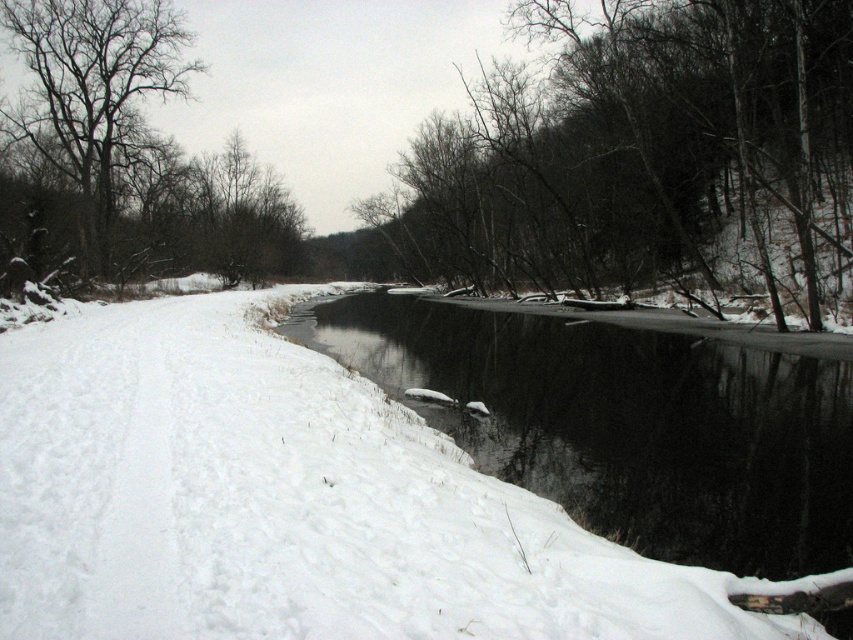
Does black ice at center appear on the right side of bare branches at left?

Yes, black ice at center is to the right of bare branches at left.

Who is positioned more to the left, black ice at center or bare branches at left?

Positioned to the left is bare branches at left.

Which is behind, point (494, 396) or point (47, 152)?

Positioned behind is point (47, 152).

The width and height of the screenshot is (853, 640). In order to click on black ice at center in this screenshot , I will do `click(625, 426)`.

Is dark brown bark tree at center smaller than black ice at center?

No.

Is point (469, 128) positioned behind point (384, 387)?

Yes, it is behind point (384, 387).

Which is behind, point (456, 120) or point (541, 490)?

The point (456, 120) is behind.

Identify the location of dark brown bark tree at center. (643, 157).

Does dark brown bark tree at center have a larger size compared to bare branches at left?

Yes, dark brown bark tree at center is bigger than bare branches at left.

Is dark brown bark tree at center to the right of bare branches at left from the viewer's perspective?

Indeed, dark brown bark tree at center is positioned on the right side of bare branches at left.

What do you see at coordinates (643, 157) in the screenshot?
I see `dark brown bark tree at center` at bounding box center [643, 157].

What are the coordinates of `dark brown bark tree at center` in the screenshot? It's located at (643, 157).